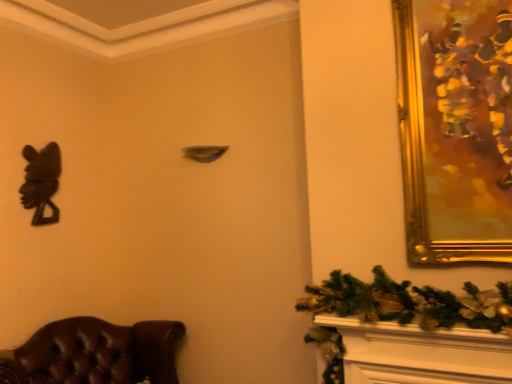
Locate an element on the screen. gold/gilded picture frame at upper right is located at coordinates (455, 128).

Image resolution: width=512 pixels, height=384 pixels. In order to click on black matte sculpture at left in this screenshot , I will do `click(41, 182)`.

Locate an element on the screen. gold/gilded picture frame at upper right is located at coordinates (455, 128).

From the image's perspective, which one is positioned lower, gold/gilded picture frame at upper right or black matte sculpture at left?

black matte sculpture at left appears lower in the image.

Considering the relative sizes of gold/gilded picture frame at upper right and black matte sculpture at left in the image provided, is gold/gilded picture frame at upper right wider than black matte sculpture at left?

Yes.

Consider the image. Who is taller, gold/gilded picture frame at upper right or black matte sculpture at left?

With more height is gold/gilded picture frame at upper right.

Could you tell me if brown leather chair at lower left is facing gold/gilded picture frame at upper right?

No, brown leather chair at lower left does not turn towards gold/gilded picture frame at upper right.

Is brown leather chair at lower left next to gold/gilded picture frame at upper right and touching it?

There is a gap between brown leather chair at lower left and gold/gilded picture frame at upper right.

From the image's perspective, which object appears higher, brown leather chair at lower left or gold/gilded picture frame at upper right?

gold/gilded picture frame at upper right, from the image's perspective.

Considering the relative sizes of brown leather chair at lower left and gold/gilded picture frame at upper right in the image provided, is brown leather chair at lower left taller than gold/gilded picture frame at upper right?

Incorrect, the height of brown leather chair at lower left is not larger of that of gold/gilded picture frame at upper right.

Where is `animal that appears above the brown leather chair at lower left (from a real-world perspective)`? animal that appears above the brown leather chair at lower left (from a real-world perspective) is located at coordinates (41, 182).

Is point (42, 188) farther from camera compared to point (7, 368)?

Yes.

Considering the relative sizes of black matte sculpture at left and brown leather chair at lower left in the image provided, is black matte sculpture at left taller than brown leather chair at lower left?

Correct, black matte sculpture at left is much taller as brown leather chair at lower left.

Measure the distance from black matte sculpture at left to brown leather chair at lower left.

A distance of 29.26 inches exists between black matte sculpture at left and brown leather chair at lower left.

Which is closer, (x=50, y=170) or (x=473, y=107)?

The point (x=473, y=107) is in front.

Are black matte sculpture at left and gold/gilded picture frame at upper right far apart?

black matte sculpture at left is positioned a significant distance from gold/gilded picture frame at upper right.

Could you tell me if black matte sculpture at left is turned towards gold/gilded picture frame at upper right?

Yes, black matte sculpture at left is oriented towards gold/gilded picture frame at upper right.

Which object is thinner, black matte sculpture at left or gold/gilded picture frame at upper right?

With smaller width is black matte sculpture at left.

Which object is closer to the camera, brown leather chair at lower left or black matte sculpture at left?

Positioned in front is brown leather chair at lower left.

From the image's perspective, is brown leather chair at lower left on black matte sculpture at left?

No, from the image's perspective, brown leather chair at lower left is not above black matte sculpture at left.

Considering the sizes of brown leather chair at lower left and black matte sculpture at left in the image, is brown leather chair at lower left taller or shorter than black matte sculpture at left?

Clearly, brown leather chair at lower left is shorter compared to black matte sculpture at left.

From a real-world perspective, which object stands above the other?

black matte sculpture at left.

Considering the sizes of objects gold/gilded picture frame at upper right and brown leather chair at lower left in the image provided, who is taller, gold/gilded picture frame at upper right or brown leather chair at lower left?

With more height is gold/gilded picture frame at upper right.

Is gold/gilded picture frame at upper right not close to brown leather chair at lower left?

gold/gilded picture frame at upper right is positioned a significant distance from brown leather chair at lower left.

Is gold/gilded picture frame at upper right positioned behind brown leather chair at lower left?

No, it is in front of brown leather chair at lower left.

Locate an element on the screen. The image size is (512, 384). picture frame in front of the black matte sculpture at left is located at coordinates (455, 128).

Where is `furniture below the gold/gilded picture frame at upper right (from the image's perspective)`? The image size is (512, 384). furniture below the gold/gilded picture frame at upper right (from the image's perspective) is located at coordinates (95, 353).

Considering their positions, is black matte sculpture at left positioned further to gold/gilded picture frame at upper right than brown leather chair at lower left?

black matte sculpture at left is further to gold/gilded picture frame at upper right.

Estimate the real-world distances between objects in this image. Which object is further from gold/gilded picture frame at upper right, brown leather chair at lower left or black matte sculpture at left?

Among the two, black matte sculpture at left is located further to gold/gilded picture frame at upper right.

From the image, which object appears to be farther from black matte sculpture at left, brown leather chair at lower left or gold/gilded picture frame at upper right?

gold/gilded picture frame at upper right.

Looking at the image, which one is located further to black matte sculpture at left, gold/gilded picture frame at upper right or brown leather chair at lower left?

The object further to black matte sculpture at left is gold/gilded picture frame at upper right.

Based on their spatial positions, is gold/gilded picture frame at upper right or black matte sculpture at left further from brown leather chair at lower left?

gold/gilded picture frame at upper right is positioned further to the anchor brown leather chair at lower left.

Looking at the image, which one is located closer to brown leather chair at lower left, black matte sculpture at left or gold/gilded picture frame at upper right?

black matte sculpture at left is closer to brown leather chair at lower left.

Image resolution: width=512 pixels, height=384 pixels. In order to click on furniture located between black matte sculpture at left and gold/gilded picture frame at upper right in the left-right direction in this screenshot , I will do `click(95, 353)`.